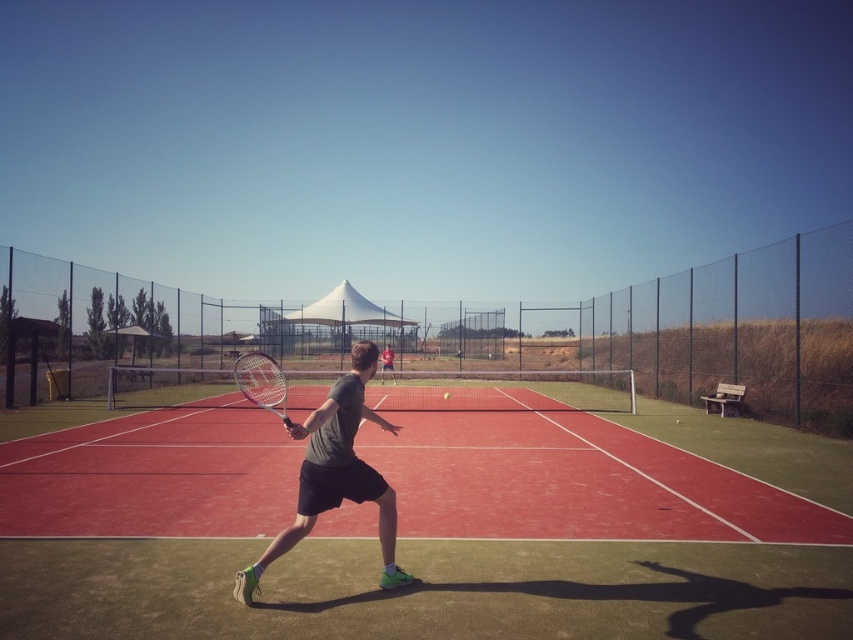
Which is below, matte gray shirt at center or yellow rubber tennis ball at center?

yellow rubber tennis ball at center is lower down.

Does matte gray shirt at center appear on the left side of yellow rubber tennis ball at center?

Correct, you'll find matte gray shirt at center to the left of yellow rubber tennis ball at center.

Between point (392, 374) and point (447, 396), which one is positioned behind?

Point (392, 374)

You are a GUI agent. You are given a task and a screenshot of the screen. Output one action in this format:
    pyautogui.click(x=<x>, y=<y>)
    Task: Click on the matte gray shirt at center
    
    Given the screenshot: What is the action you would take?
    click(386, 362)

Does red rubber tennis court at center have a lesser width compared to matte gray shirt at center?

Incorrect, red rubber tennis court at center's width is not less than matte gray shirt at center's.

Does point (618, 541) lie in front of point (389, 362)?

Yes.

In order to click on red rubber tennis court at center in this screenshot , I will do `click(440, 552)`.

From the picture: Who is shorter, gray matte tennis racket at center or yellow rubber tennis ball at center?

yellow rubber tennis ball at center is shorter.

Is gray matte tennis racket at center below yellow rubber tennis ball at center?

Actually, gray matte tennis racket at center is above yellow rubber tennis ball at center.

You are a GUI agent. You are given a task and a screenshot of the screen. Output one action in this format:
    pyautogui.click(x=<x>, y=<y>)
    Task: Click on the gray matte tennis racket at center
    The width and height of the screenshot is (853, 640).
    Given the screenshot: What is the action you would take?
    pyautogui.click(x=335, y=472)